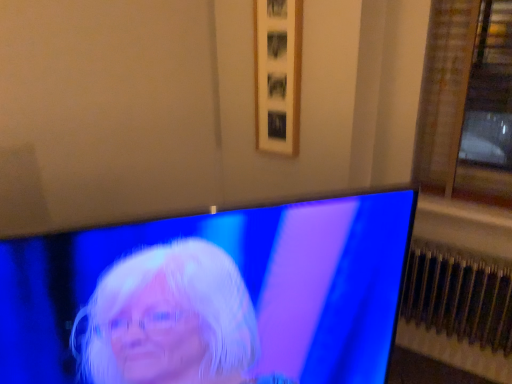
Question: Can you confirm if metallic silver radiator at lower right is smaller than shiny blue screen at center?

Choices:
 (A) yes
 (B) no

Answer: (A)

Question: Can we say metallic silver radiator at lower right lies outside shiny blue screen at center?

Choices:
 (A) yes
 (B) no

Answer: (A)

Question: Does metallic silver radiator at lower right have a larger size compared to shiny blue screen at center?

Choices:
 (A) no
 (B) yes

Answer: (A)

Question: Does metallic silver radiator at lower right have a lesser width compared to shiny blue screen at center?

Choices:
 (A) no
 (B) yes

Answer: (A)

Question: Does metallic silver radiator at lower right appear on the left side of shiny blue screen at center?

Choices:
 (A) no
 (B) yes

Answer: (A)

Question: From a real-world perspective, is metallic silver radiator at lower right positioned above or below shiny blue screen at center?

Choices:
 (A) above
 (B) below

Answer: (B)

Question: Considering the relative positions of metallic silver radiator at lower right and shiny blue screen at center in the image provided, is metallic silver radiator at lower right to the left or to the right of shiny blue screen at center?

Choices:
 (A) right
 (B) left

Answer: (A)

Question: Considering the positions of metallic silver radiator at lower right and shiny blue screen at center in the image, is metallic silver radiator at lower right taller or shorter than shiny blue screen at center?

Choices:
 (A) tall
 (B) short

Answer: (B)

Question: Is metallic silver radiator at lower right inside the boundaries of shiny blue screen at center, or outside?

Choices:
 (A) inside
 (B) outside

Answer: (B)

Question: Choose the correct answer: Is metallic silver radiator at lower right inside wooden picture frame at upper center or outside it?

Choices:
 (A) inside
 (B) outside

Answer: (B)

Question: Considering the positions of metallic silver radiator at lower right and wooden picture frame at upper center in the image, is metallic silver radiator at lower right bigger or smaller than wooden picture frame at upper center?

Choices:
 (A) small
 (B) big

Answer: (B)

Question: Relative to wooden picture frame at upper center, is metallic silver radiator at lower right in front or behind?

Choices:
 (A) front
 (B) behind

Answer: (A)

Question: Is point (409, 301) positioned closer to the camera than point (282, 54)?

Choices:
 (A) farther
 (B) closer

Answer: (A)

Question: Is wooden picture frame at upper center bigger or smaller than shiny blue screen at center?

Choices:
 (A) small
 (B) big

Answer: (A)

Question: From the image's perspective, is wooden picture frame at upper center above or below shiny blue screen at center?

Choices:
 (A) above
 (B) below

Answer: (A)